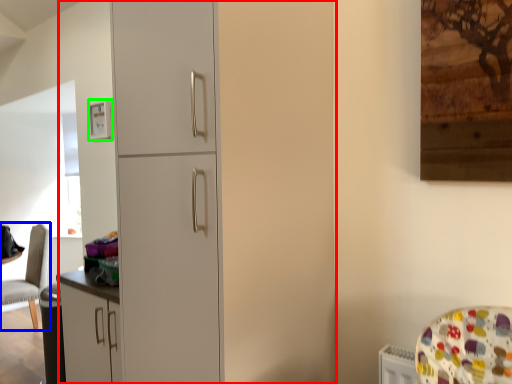
Question: Estimate the real-world distances between objects in this image. Which object is farther from dresser (highlighted by a red box), chair (highlighted by a blue box) or picture frame (highlighted by a green box)?

Choices:
 (A) chair
 (B) picture frame

Answer: (A)